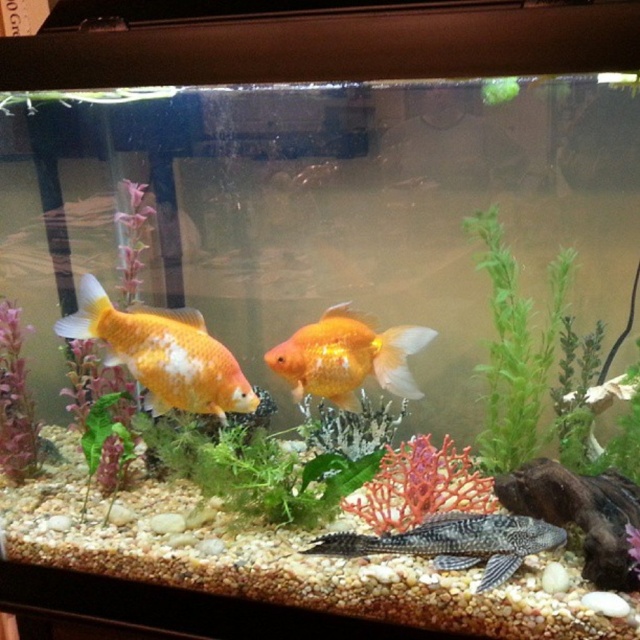
Does matte purple plant at left have a larger size compared to green leafy plant at center?

Indeed, matte purple plant at left has a larger size compared to green leafy plant at center.

Between matte purple plant at left and green leafy plant at center, which one has less height?

green leafy plant at center

Identify the location of matte purple plant at left. The width and height of the screenshot is (640, 640). (16, 401).

Is black matte fish at bottom closer to camera compared to green leafy plant at center?

Yes, it is.

Which is more to the right, black matte fish at bottom or green leafy plant at center?

From the viewer's perspective, black matte fish at bottom appears more on the right side.

Does point (470, 515) come farther from viewer compared to point (88, 413)?

No.

Where is `black matte fish at bottom`? This screenshot has width=640, height=640. black matte fish at bottom is located at coordinates (456, 541).

Between point (193, 344) and point (83, 435), which one is positioned in front?

Point (193, 344)

Can you confirm if shiny orange goldfish at center is thinner than green leafy plant at center?

No, shiny orange goldfish at center is not thinner than green leafy plant at center.

Between point (221, 420) and point (129, 456), which one is positioned behind?

Point (221, 420)

Locate an element on the screen. shiny orange goldfish at center is located at coordinates (163, 353).